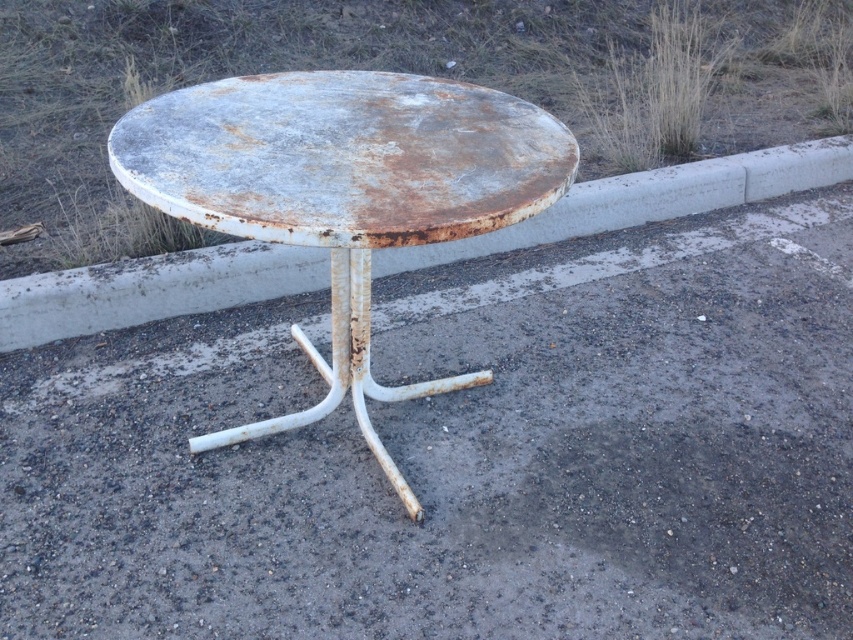
Question: Among these objects, which one is farthest from the camera?

Choices:
 (A) concrete curb at center
 (B) rusty metal table at center

Answer: (A)

Question: Is rusty metal table at center wider than concrete curb at center?

Choices:
 (A) no
 (B) yes

Answer: (A)

Question: Can you confirm if rusty metal table at center is smaller than concrete curb at center?

Choices:
 (A) no
 (B) yes

Answer: (B)

Question: Does rusty metal table at center come in front of concrete curb at center?

Choices:
 (A) yes
 (B) no

Answer: (A)